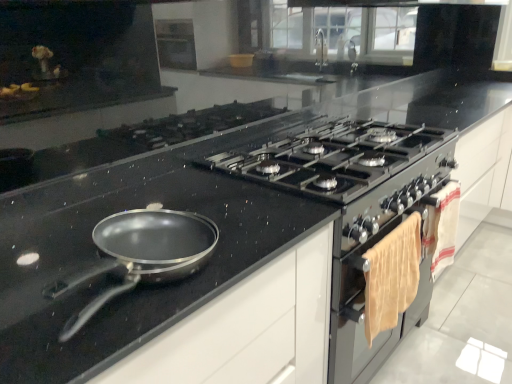
What is the approximate height of black glass gas stove at center?

It is 8.37 inches.

Where is `white cotton towel at right`? white cotton towel at right is located at coordinates (x=445, y=228).

The height and width of the screenshot is (384, 512). I want to click on matte silver oven at right, so click(364, 310).

Where is `black glass gas stove at center`? black glass gas stove at center is located at coordinates (333, 157).

Would you say black glass gas stove at center is inside or outside white cotton towel at right?

black glass gas stove at center is not enclosed by white cotton towel at right.

Considering the relative positions of black glass gas stove at center and white cotton towel at right in the image provided, is black glass gas stove at center behind white cotton towel at right?

No, black glass gas stove at center is closer to the camera.

Is point (327, 183) closer to camera compared to point (443, 223)?

Yes, it is.

Which object is positioned more to the left, matte black countertop at center or black glass gas stove at center?

From the viewer's perspective, matte black countertop at center appears more on the left side.

At what (x,y) coordinates should I click in order to perform the action: click on gas stove above the matte black countertop at center (from a real-world perspective). Please return your answer as a coordinate pair (x, y). The width and height of the screenshot is (512, 384). Looking at the image, I should click on (333, 157).

Which of these two, matte black countertop at center or black glass gas stove at center, is thinner?

Thinner between the two is matte black countertop at center.

From the picture: Considering the sizes of objects matte black countertop at center and black glass gas stove at center in the image provided, who is shorter, matte black countertop at center or black glass gas stove at center?

Standing shorter between the two is black glass gas stove at center.

Which object is closer to the camera, matte black countertop at center or white cotton towel at right?

matte black countertop at center is more forward.

Would you say matte black countertop at center is outside white cotton towel at right?

matte black countertop at center lies outside white cotton towel at right's area.

Based on the photo, how far apart are matte black countertop at center and white cotton towel at right?

matte black countertop at center and white cotton towel at right are 92.26 centimeters apart.

Does point (215, 299) come in front of point (439, 239)?

Yes.

Is white cotton towel at right positioned behind matte black countertop at center?

Yes, white cotton towel at right is further from the viewer.

Looking at this image, is white cotton towel at right to the left or to the right of matte black countertop at center in the image?

white cotton towel at right is positioned on matte black countertop at center's right side.

Choose the correct answer: Is white cotton towel at right inside matte black countertop at center or outside it?

white cotton towel at right is located beyond the bounds of matte black countertop at center.

Does white cotton towel at right have a lesser height compared to matte black countertop at center?

Yes, white cotton towel at right is shorter than matte black countertop at center.

How much distance is there between matte silver oven at right and matte black countertop at center?

matte silver oven at right and matte black countertop at center are 14.05 inches apart.

Looking at this image, from the image's perspective, which object appears higher, matte silver oven at right or matte black countertop at center?

matte silver oven at right is shown above in the image.

Are matte silver oven at right and matte black countertop at center beside each other?

matte silver oven at right and matte black countertop at center are clearly separated.

In the image, is matte silver oven at right positioned in front of or behind matte black countertop at center?

Clearly, matte silver oven at right is behind matte black countertop at center.

Which object is positioned more to the right, matte black countertop at center or matte silver oven at right?

matte silver oven at right is more to the right.

From a real-world perspective, is matte black countertop at center positioned under matte silver oven at right based on gravity?

Yes, from a real-world perspective, matte black countertop at center is beneath matte silver oven at right.

Image resolution: width=512 pixels, height=384 pixels. I want to click on oven that is behind the matte black countertop at center, so click(364, 310).

Based on the photo, would you say white cotton towel at right is outside matte silver oven at right?

Yes, white cotton towel at right is not within matte silver oven at right.

Does point (445, 229) lie in front of point (400, 315)?

No, (445, 229) is behind (400, 315).

Is white cotton towel at right bigger or smaller than matte silver oven at right?

Clearly, white cotton towel at right is smaller in size than matte silver oven at right.

Where is `material behind the black glass gas stove at center`? This screenshot has height=384, width=512. material behind the black glass gas stove at center is located at coordinates (445, 228).

At what (x,y) coordinates should I click in order to perform the action: click on cabinetry below the black glass gas stove at center (from the image's perspective). Please return your answer as a coordinate pair (x, y). The width and height of the screenshot is (512, 384). Looking at the image, I should click on (248, 329).

Considering their positions, is white cotton towel at right positioned further to black glass gas stove at center than matte black countertop at center?

matte black countertop at center is further to black glass gas stove at center.

Looking at the image, which one is located further to matte silver oven at right, black glass gas stove at center or matte black countertop at center?

The object further to matte silver oven at right is matte black countertop at center.

Consider the image. Estimate the real-world distances between objects in this image. Which object is further from black glass gas stove at center, matte black countertop at center or white cotton towel at right?

matte black countertop at center lies further to black glass gas stove at center than the other object.

Looking at the image, which one is located closer to black glass gas stove at center, white cotton towel at right or matte silver oven at right?

Based on the image, matte silver oven at right appears to be nearer to black glass gas stove at center.

Considering their positions, is white cotton towel at right positioned closer to matte silver oven at right than matte black countertop at center?

white cotton towel at right lies closer to matte silver oven at right than the other object.

From the image, which object appears to be nearer to matte black countertop at center, white cotton towel at right or matte silver oven at right?

matte silver oven at right is positioned closer to the anchor matte black countertop at center.

In the scene shown: Looking at the image, which one is located closer to black glass gas stove at center, matte black countertop at center or matte silver oven at right?

The object closer to black glass gas stove at center is matte silver oven at right.

Looking at the image, which one is located further to black glass gas stove at center, matte silver oven at right or white cotton towel at right?

Among the two, white cotton towel at right is located further to black glass gas stove at center.

Identify the location of gas stove situated between matte black countertop at center and white cotton towel at right from left to right. (333, 157).

At what (x,y) coordinates should I click in order to perform the action: click on oven between black glass gas stove at center and white cotton towel at right in the front-back direction. Please return your answer as a coordinate pair (x, y). This screenshot has height=384, width=512. Looking at the image, I should click on [364, 310].

This screenshot has height=384, width=512. In order to click on oven between matte black countertop at center and white cotton towel at right in the horizontal direction in this screenshot , I will do `click(364, 310)`.

Where is `gas stove between matte black countertop at center and matte silver oven at right`? This screenshot has width=512, height=384. gas stove between matte black countertop at center and matte silver oven at right is located at coordinates click(333, 157).